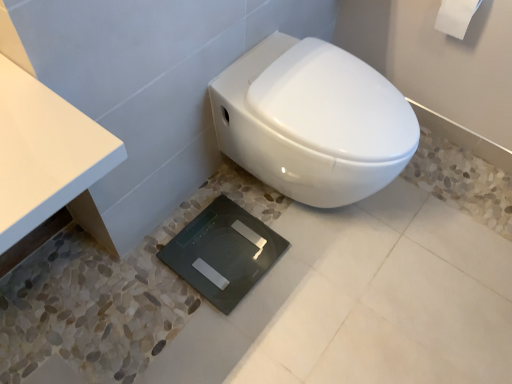
Question: Do you think black glass scale at center is within white glossy toilet at center, or outside of it?

Choices:
 (A) inside
 (B) outside

Answer: (B)

Question: Considering the positions of black glass scale at center and white glossy toilet at center in the image, is black glass scale at center bigger or smaller than white glossy toilet at center?

Choices:
 (A) big
 (B) small

Answer: (B)

Question: Which of these objects is positioned closest to the white matte toilet paper at upper right?

Choices:
 (A) white glossy toilet at center
 (B) black glass scale at center

Answer: (A)

Question: Estimate the real-world distances between objects in this image. Which object is closer to the white glossy toilet at center?

Choices:
 (A) white matte toilet paper at upper right
 (B) black glass scale at center

Answer: (B)